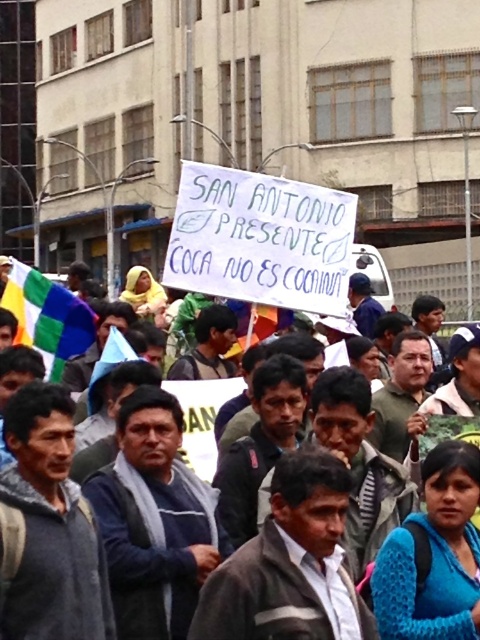
You are a photographer trying to capture the protest scene. You notice the white paper sign at center and the multicolored fabric flag at left. Which object would appear bigger in your photo if you focus on the center?

The white paper sign at center appears bigger in the photo because it has a larger size compared to the multicolored fabric flag at left.

You are a photographer trying to capture the protest scene. You notice the white paper sign at center and the multicolored fabric flag at left. Which object is positioned higher in the image?

The white paper sign at center is located above the multicolored fabric flag at left, so it is positioned higher in the image.

Based on the scene description, where is the white paper sign at center located in the image?

The white paper sign at center is located at point 0.609 on the x axis and 0.879 on the y axis.